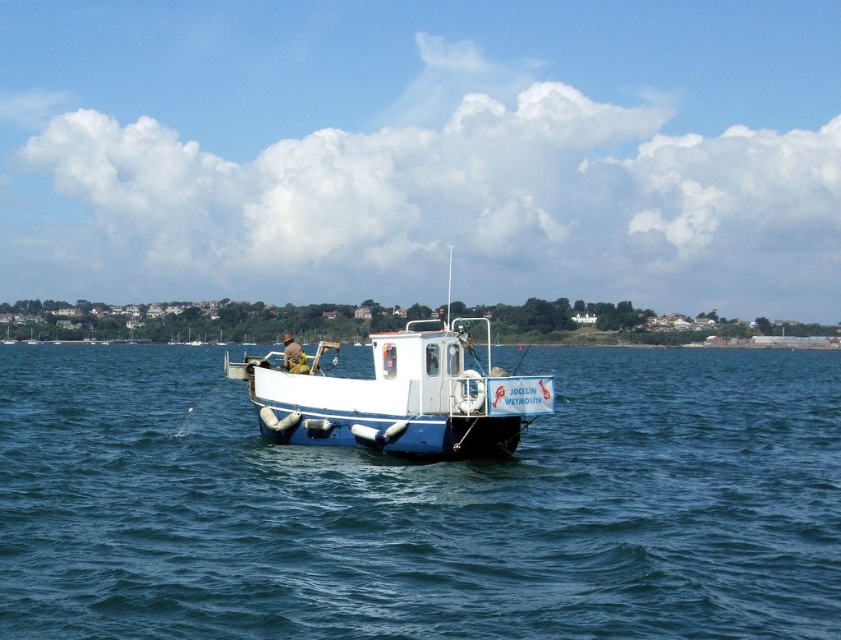
Is point (109, 429) closer to camera compared to point (482, 445)?

That is False.

The height and width of the screenshot is (640, 841). What do you see at coordinates (421, 506) in the screenshot? I see `blue rubber boat at center` at bounding box center [421, 506].

Locate an element on the screen. The image size is (841, 640). blue rubber boat at center is located at coordinates (421, 506).